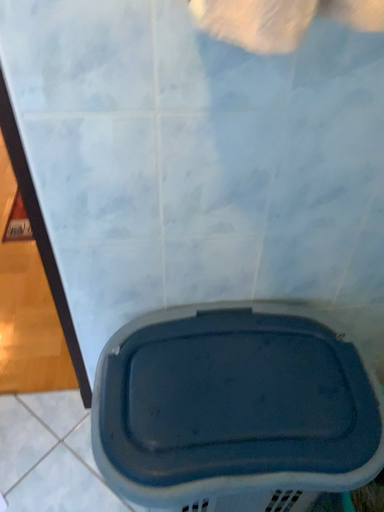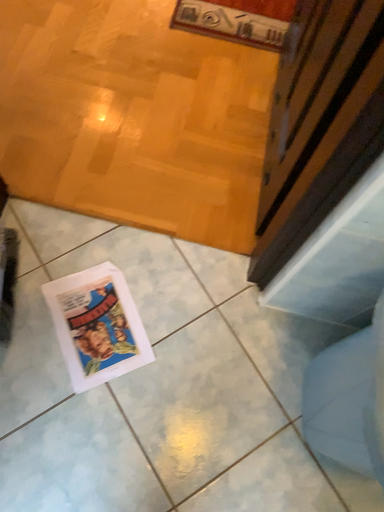
Question: How did the camera likely rotate when shooting the video?

Choices:
 (A) rotated left
 (B) rotated right

Answer: (A)